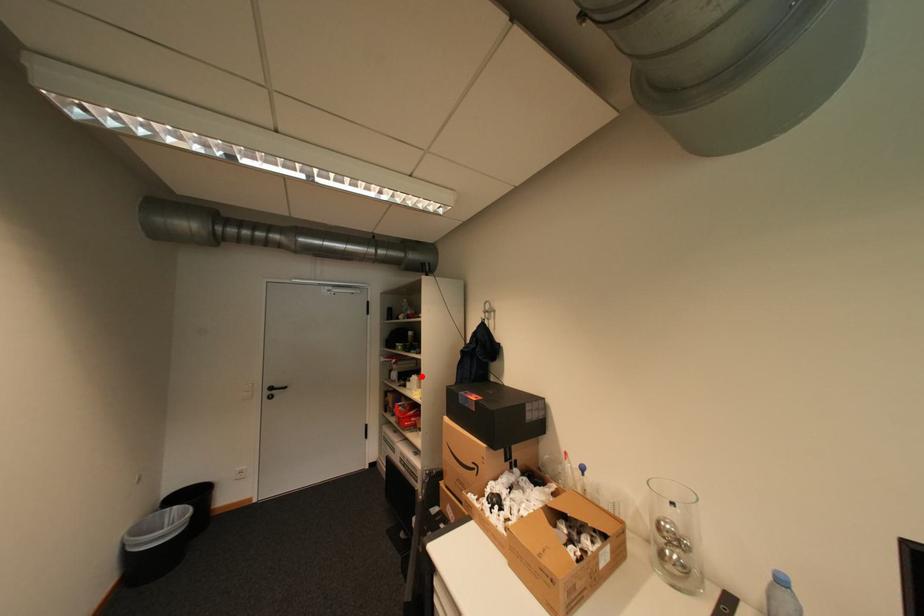
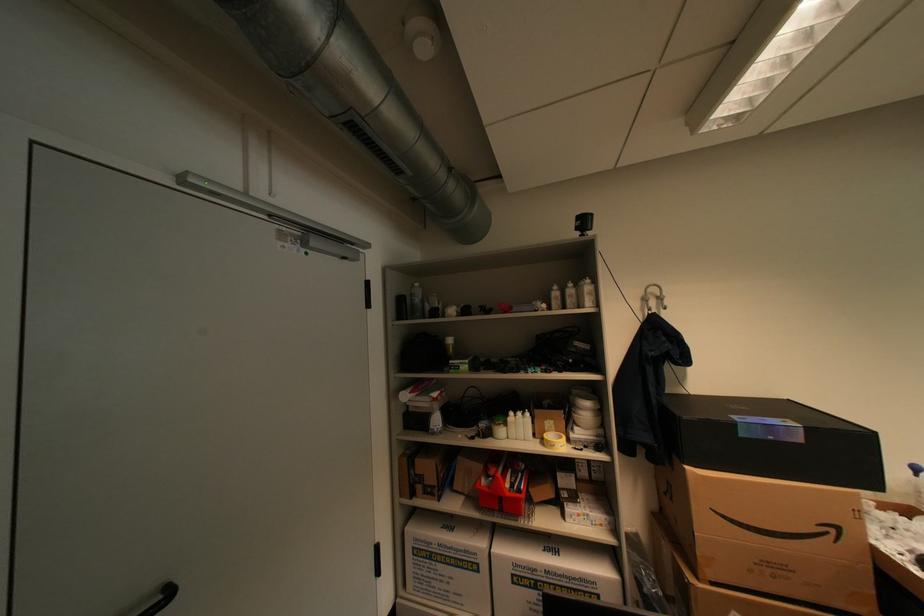
Where in the second image is the point corresponding to the highlighted location from the first image?

(519, 414)